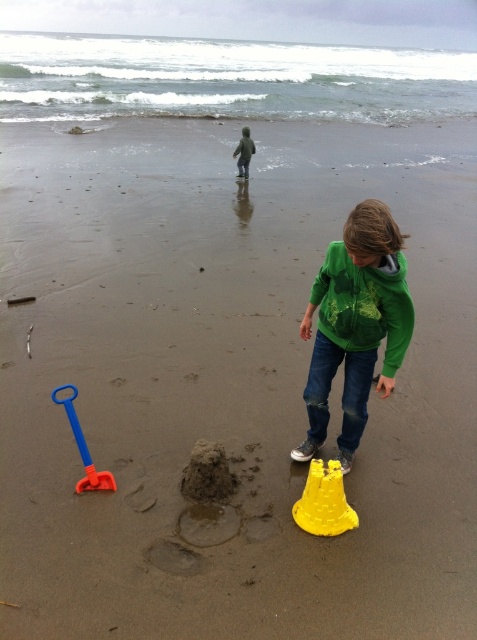
From the picture: You are a parent trying to locate your child who is wearing a green matte jacket at upper center. You see a blue plastic shovel at lower left near the sand. Based on their sizes, can you tell which object is closer to you?

The blue plastic shovel at lower left is not as tall as the green matte jacket at upper center, which means the shovel is closer to you since smaller objects in the foreground appear smaller than those in the background.

You are a parent trying to locate your child on the beach. You see the blue plastic shovel at lower left and the green matte jacket at upper center. Which object is closer to you?

The blue plastic shovel at lower left is smaller than the green matte jacket at upper center, which suggests it is closer to you since smaller objects can appear closer in perspective.